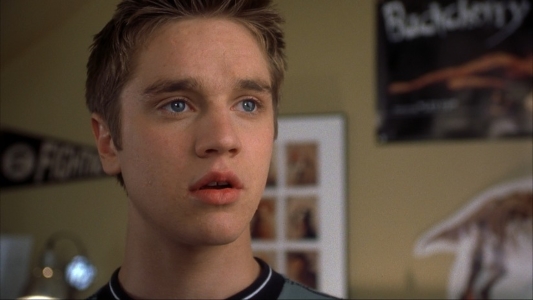
Where is `dinosaur poster`? The height and width of the screenshot is (300, 533). dinosaur poster is located at coordinates (505, 237).